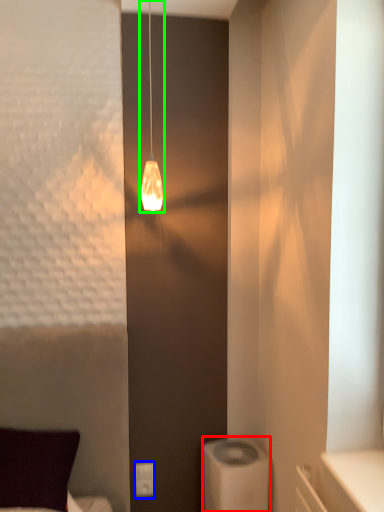
Question: Estimate the real-world distances between objects in this image. Which object is closer to appliance (highlighted by a red box), light switch (highlighted by a blue box) or lamp (highlighted by a green box)?

Choices:
 (A) light switch
 (B) lamp

Answer: (A)